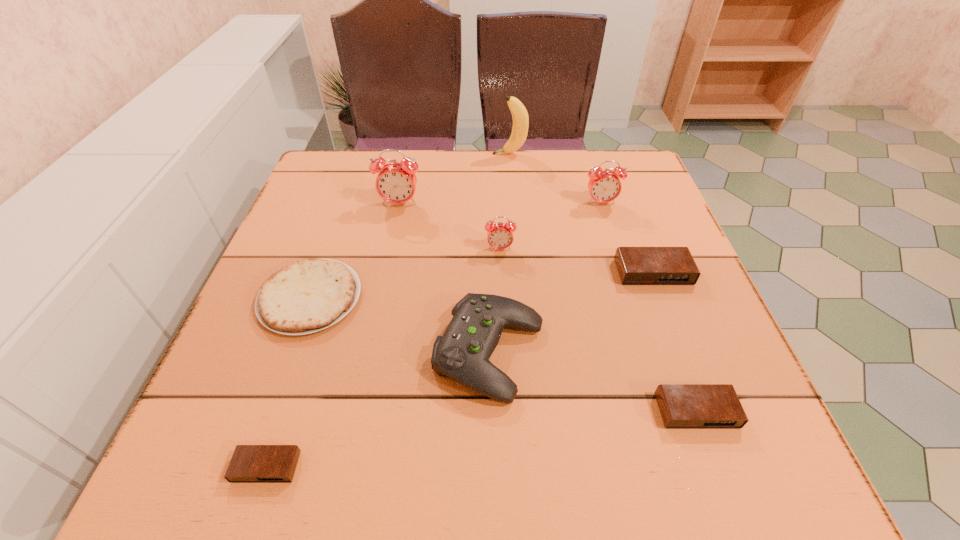
Locate an element on the screen. the second farthest black alarm clock is located at coordinates click(682, 406).

Where is `the second shortest alarm clock`? Image resolution: width=960 pixels, height=540 pixels. the second shortest alarm clock is located at coordinates (682, 406).

The width and height of the screenshot is (960, 540). Identify the location of tortilla. (309, 295).

The height and width of the screenshot is (540, 960). Find the location of `the shortest alarm clock`. the shortest alarm clock is located at coordinates (250, 463).

This screenshot has height=540, width=960. I want to click on the shortest object, so click(250, 463).

You are a GUI agent. You are given a task and a screenshot of the screen. Output one action in this format:
    pyautogui.click(x=<x>, y=<y>)
    Task: Click on the free location located 0.080m from the stem of the banana
    
    Given the screenshot: What is the action you would take?
    pyautogui.click(x=465, y=154)

Identify the location of free space located 0.300m from the stem of the banana. The height and width of the screenshot is (540, 960). (387, 154).

This screenshot has height=540, width=960. I want to click on free spot located 0.100m from the stem of the banana, so click(x=457, y=154).

Where is `vacant space located on the face of the tallest alarm clock`? vacant space located on the face of the tallest alarm clock is located at coordinates (385, 275).

Where is `free space located on the face of the second biggest red alarm clock`? free space located on the face of the second biggest red alarm clock is located at coordinates (622, 272).